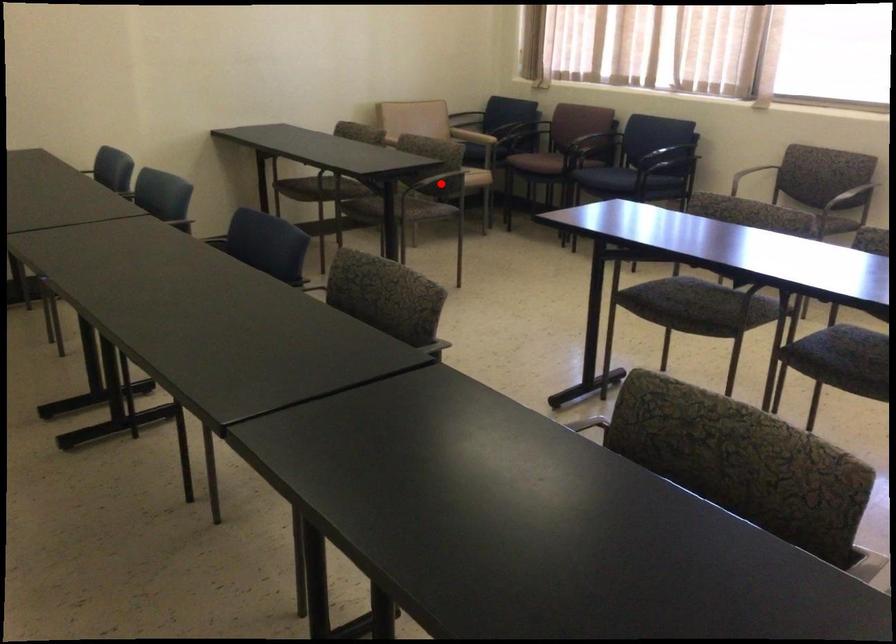
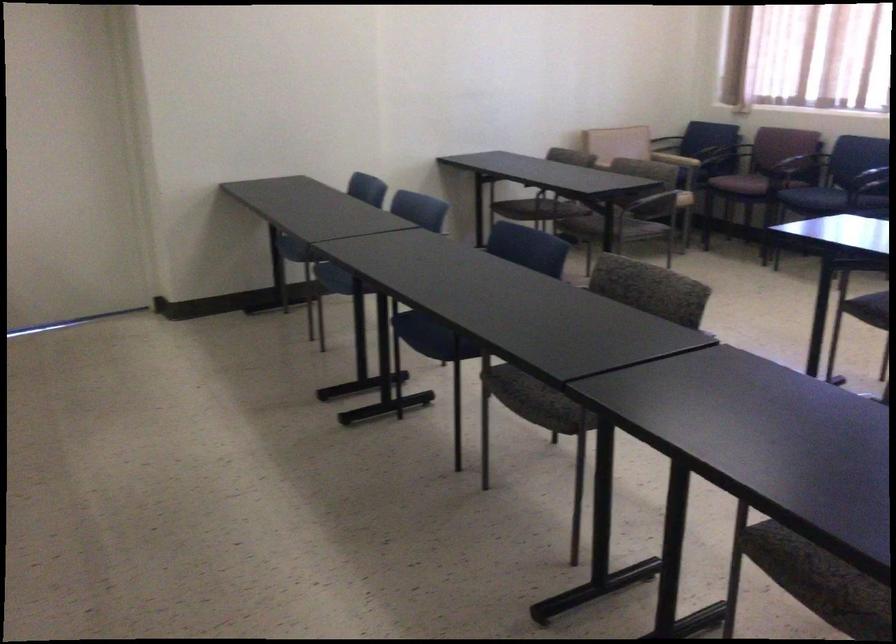
Locate, in the second image, the point that corresponds to the highlighted location in the first image.

(655, 204)